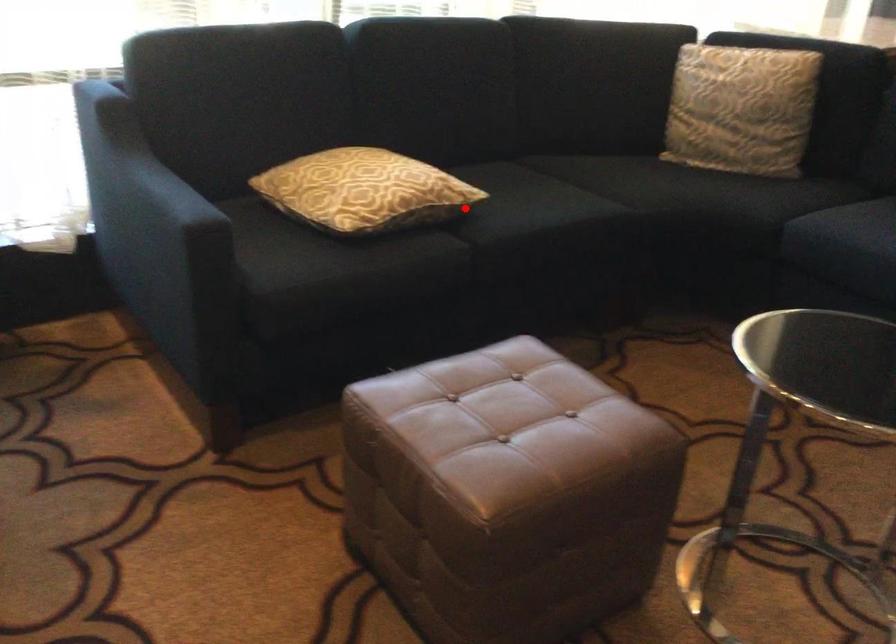
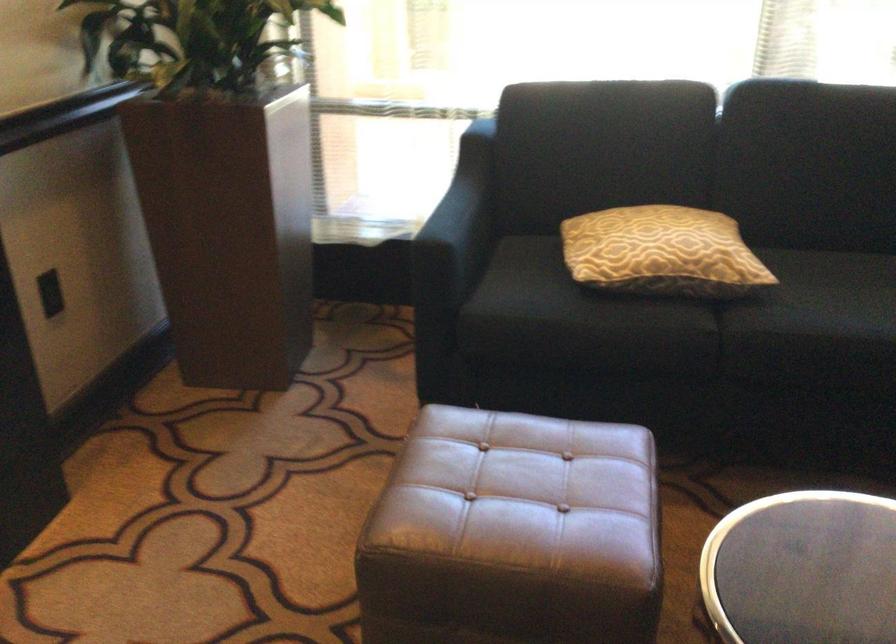
Where in the second image is the point corresponding to the highlighted location from the first image?

(752, 289)